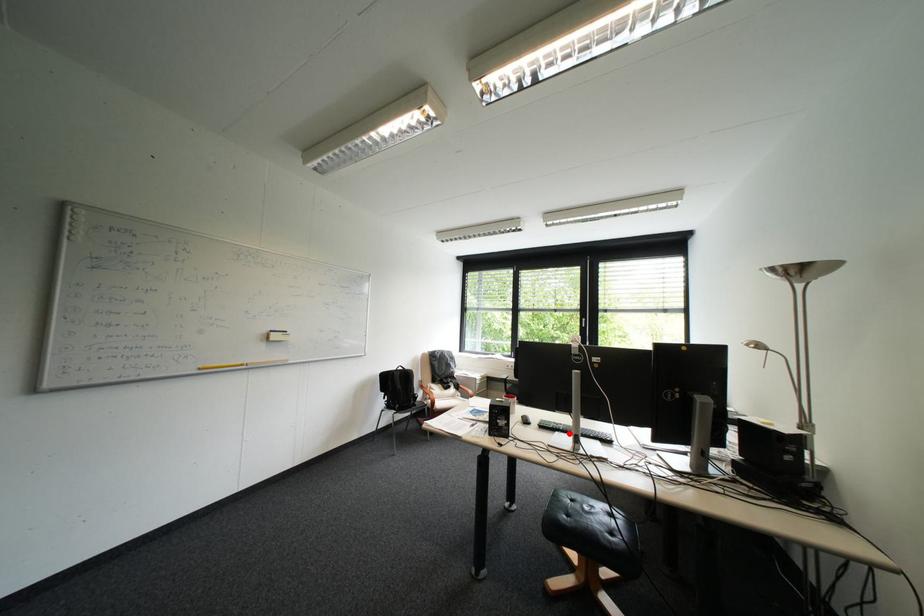
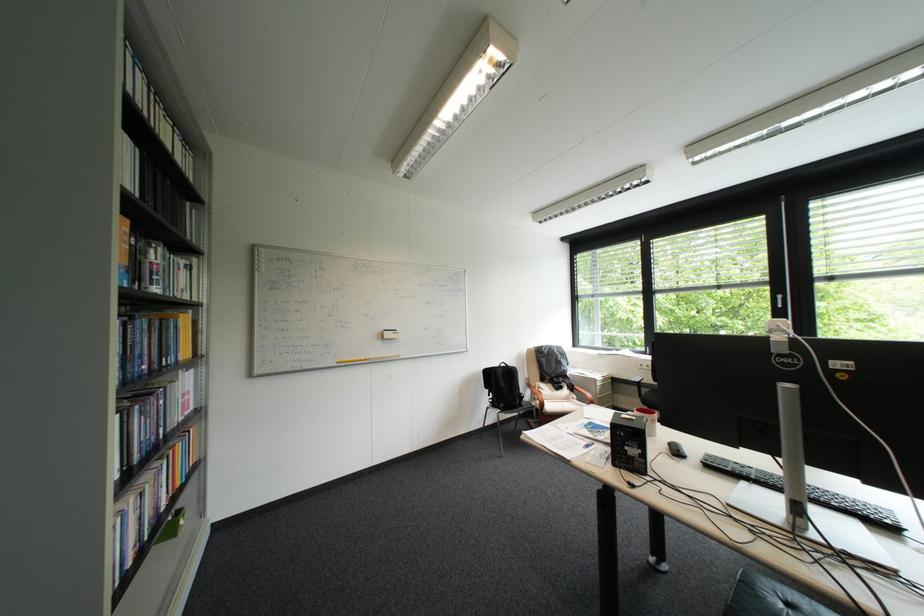
Question: I am providing you with two images of the same scene from different viewpoints. In image1, a red point is highlighted. Considering the same 3D point in image2, which of the following is correct?

Choices:
 (A) It is closer
 (B) It is farther

Answer: (A)